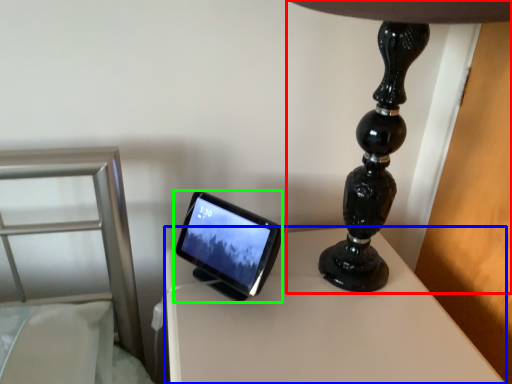
Question: Considering the real-world distances, which object is farthest from lamp (highlighted by a red box)? table (highlighted by a blue box) or tablet computer (highlighted by a green box)?

Choices:
 (A) table
 (B) tablet computer

Answer: (B)